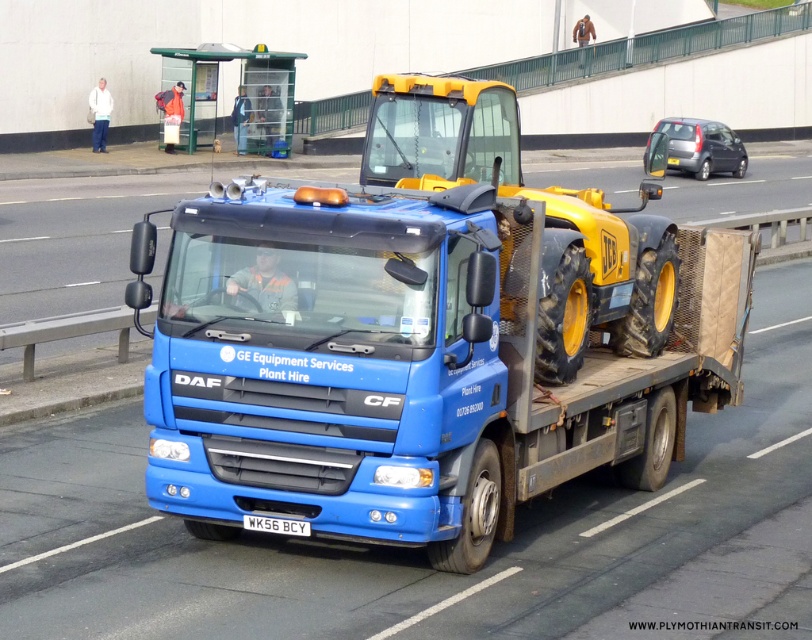
Question: Which object appears farthest from the camera in this image?

Choices:
 (A) white plastic license plate at center
 (B) blue matte truck at center

Answer: (A)

Question: Where is blue matte truck at center located in relation to white plastic license plate at center in the image?

Choices:
 (A) above
 (B) below

Answer: (A)

Question: Can you confirm if blue matte truck at center is positioned below white plastic license plate at center?

Choices:
 (A) no
 (B) yes

Answer: (A)

Question: Can you confirm if blue matte truck at center is thinner than white plastic license plate at center?

Choices:
 (A) yes
 (B) no

Answer: (B)

Question: Which point is closer to the camera?

Choices:
 (A) white plastic license plate at center
 (B) blue matte truck at center

Answer: (B)